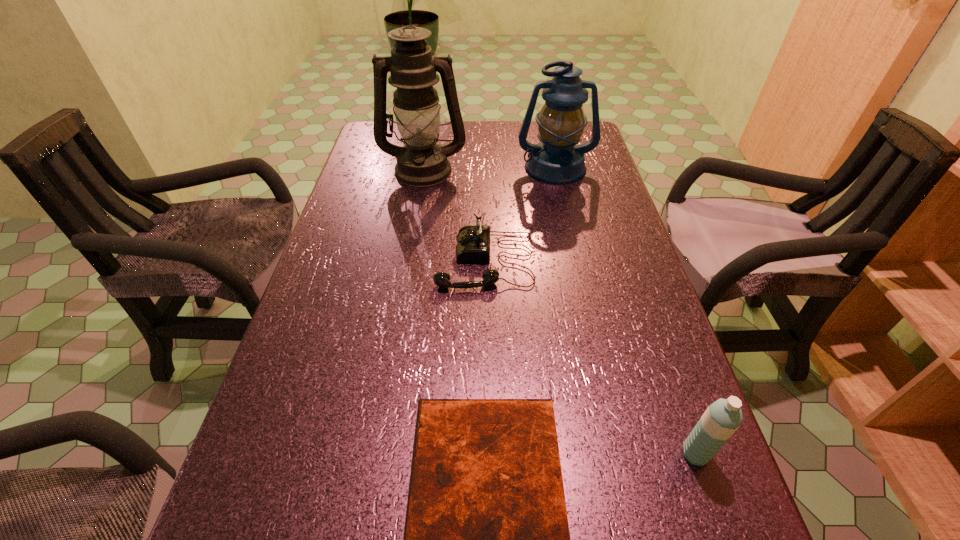
Locate an element on the screen. vacant area that lies between the telephone and the lantern is located at coordinates (520, 214).

This screenshot has height=540, width=960. I want to click on vacant space that is in between the oil lamp and the second tallest object, so click(490, 168).

The width and height of the screenshot is (960, 540). Find the location of `vacant region between the oil lamp and the third shortest object`. vacant region between the oil lamp and the third shortest object is located at coordinates (560, 312).

Find the location of `free space between the lantern and the water bottle`. free space between the lantern and the water bottle is located at coordinates (625, 310).

I want to click on object identified as the closest to the water bottle, so click(x=486, y=539).

What are the coordinates of `object that is the fourth closest to the shortest object` in the screenshot? It's located at (557, 159).

The image size is (960, 540). What are the coordinates of `free space that satisfies the following two spatial constraints: 1. on the dial of the third shortest object; 2. on the right side of the telephone` in the screenshot? It's located at (487, 454).